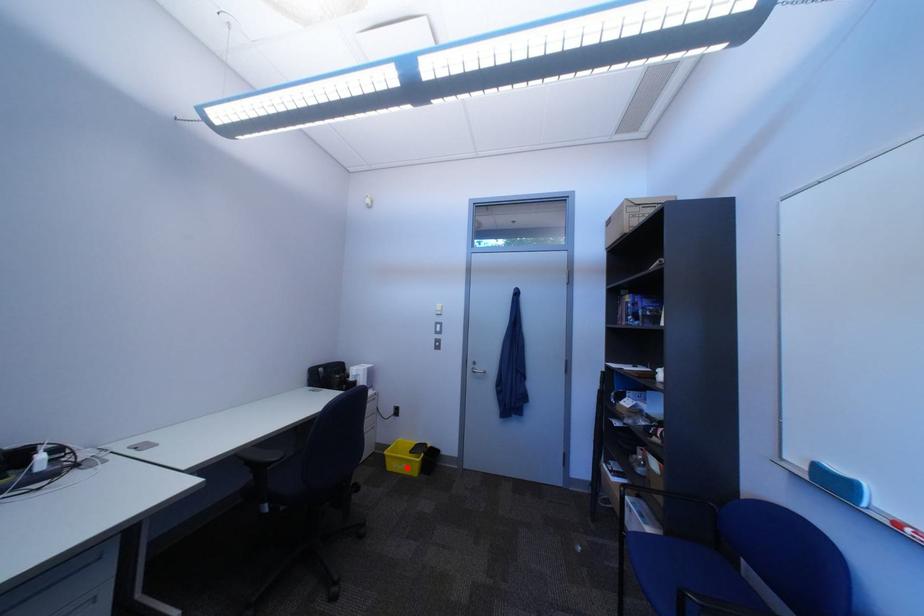
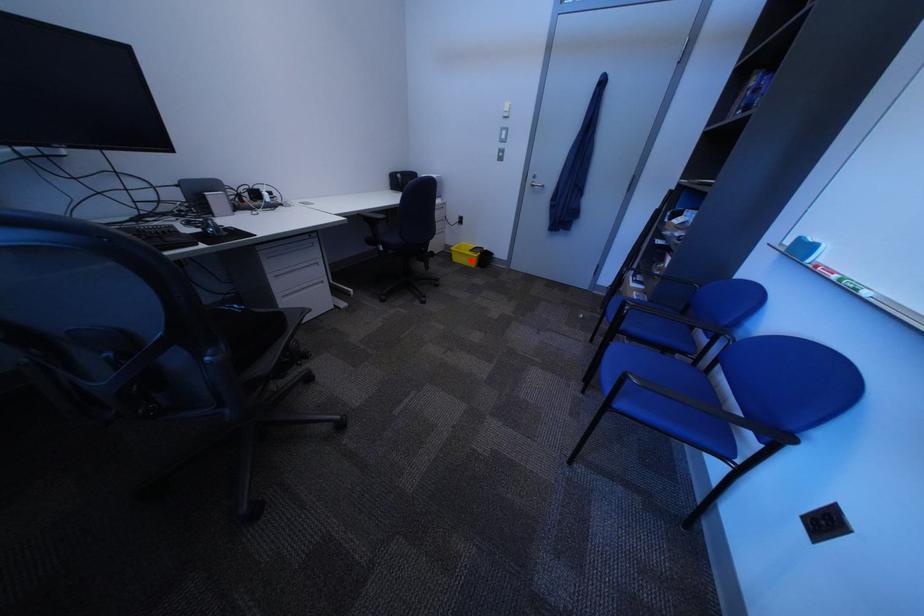
I am providing you with two images of the same scene from different viewpoints. A red point is marked on the first image and another point is marked on the second image. Does the point marked in image1 correspond to the same location as the one in image2?

Yes